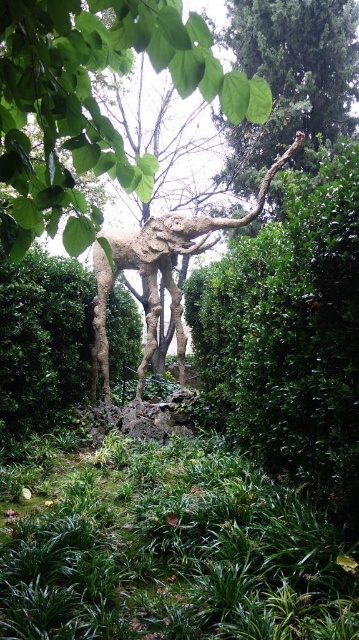
Question: Based on their relative distances, which object is farther from the green matte bush at center?

Choices:
 (A) green leafy bush at center
 (B) rustic stone sculpture at center
 (C) rough bark tree at upper center

Answer: (C)

Question: Among these points, which one is farthest from the camera?

Choices:
 (A) (337, 56)
 (B) (330, 356)
 (C) (202, 250)

Answer: (A)

Question: Where is rough bark tree at upper center located in relation to green rough bark tree at upper center in the image?

Choices:
 (A) below
 (B) above

Answer: (A)

Question: Is rough bark tree at upper center smaller than green rough bark tree at upper center?

Choices:
 (A) yes
 (B) no

Answer: (A)

Question: Which object is closer to the camera taking this photo?

Choices:
 (A) green leafy bush at center
 (B) green rough bark tree at upper center
 (C) rough bark tree at upper center

Answer: (C)

Question: Does green leafy grass at lower center appear under green rough bark tree at upper center?

Choices:
 (A) no
 (B) yes

Answer: (B)